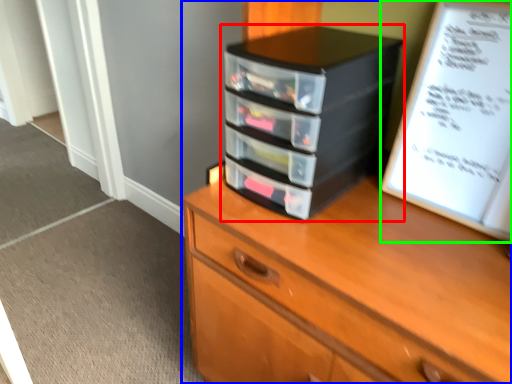
Question: Which object is the closest to the nightstand (highlighted by a red box)? Choose among these: chest of drawers (highlighted by a blue box) or paperback book (highlighted by a green box).

Choices:
 (A) chest of drawers
 (B) paperback book

Answer: (B)